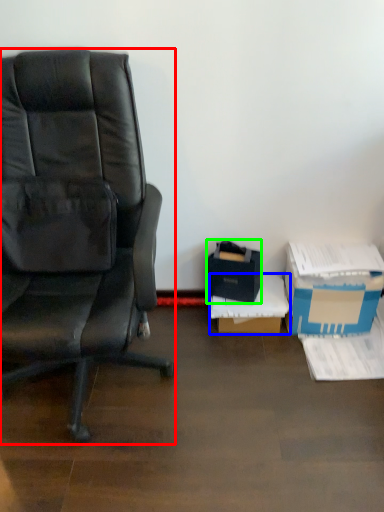
Question: Considering the real-world distances, which object is closest to chair (highlighted by a red box)? box (highlighted by a blue box) or box (highlighted by a green box).

Choices:
 (A) box
 (B) box

Answer: (B)